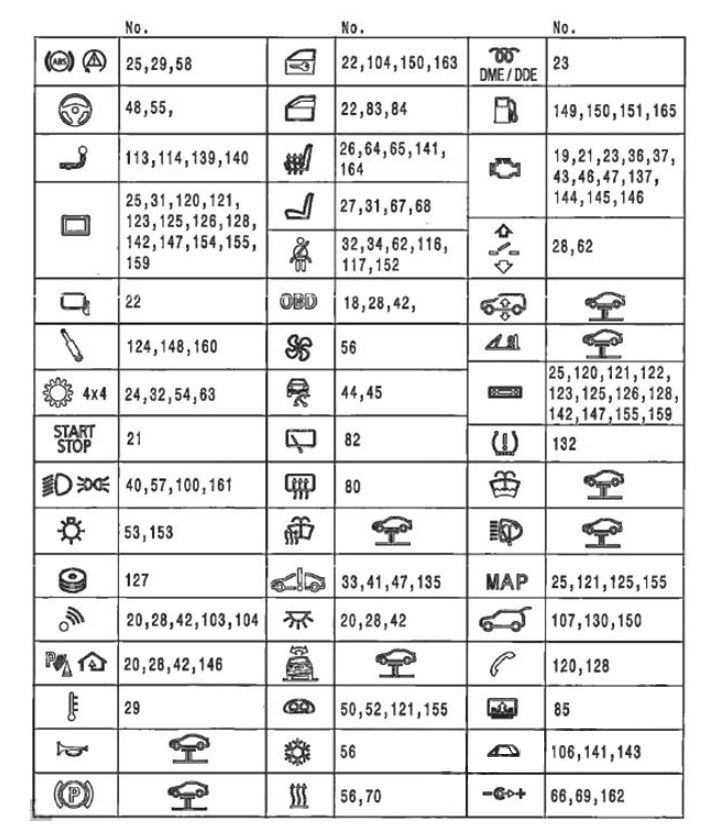
What are the coordinates of `fan` in the screenshot? It's located at (295, 344).